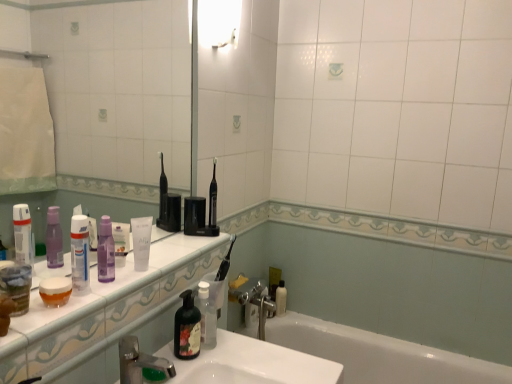
Question: Does silver metallic faucet at lower center have a lesser width compared to white matte tube at center, placed as the 2th toiletry when sorted from left to right?

Choices:
 (A) yes
 (B) no

Answer: (B)

Question: Is silver metallic faucet at lower center taller than white matte tube at center, positioned as the 4th toiletry in right-to-left order?

Choices:
 (A) yes
 (B) no

Answer: (B)

Question: Does silver metallic faucet at lower center have a larger size compared to white matte tube at center, which appears as the 4th toiletry when viewed from the back?

Choices:
 (A) yes
 (B) no

Answer: (B)

Question: Can you confirm if silver metallic faucet at lower center is positioned to the left of white matte tube at center, positioned as the 4th toiletry in right-to-left order?

Choices:
 (A) no
 (B) yes

Answer: (A)

Question: From the image's perspective, would you say silver metallic faucet at lower center is shown under white matte tube at center, placed as the second toiletry when sorted from front to back?

Choices:
 (A) no
 (B) yes

Answer: (B)

Question: Considering the positions of white glossy bathtub at lower center and black plastic toothbrush at center in the image, is white glossy bathtub at lower center taller or shorter than black plastic toothbrush at center?

Choices:
 (A) tall
 (B) short

Answer: (A)

Question: From the image's perspective, relative to black plastic toothbrush at center, is white glossy bathtub at lower center above or below?

Choices:
 (A) above
 (B) below

Answer: (B)

Question: Considering the positions of point (279, 342) and point (214, 225), is point (279, 342) closer or farther from the camera than point (214, 225)?

Choices:
 (A) closer
 (B) farther

Answer: (B)

Question: Is white glossy bathtub at lower center spatially inside black plastic toothbrush at center, or outside of it?

Choices:
 (A) outside
 (B) inside

Answer: (A)

Question: From the image's perspective, is white glossy sink at lower center above or below white matte tube at center, which appears as the 4th toiletry when viewed from the back?

Choices:
 (A) below
 (B) above

Answer: (A)

Question: Is white glossy sink at lower center to the left or to the right of white matte tube at center, placed as the 2th toiletry when sorted from left to right, in the image?

Choices:
 (A) right
 (B) left

Answer: (A)

Question: From a real-world perspective, is white glossy sink at lower center positioned above or below white matte tube at center, placed as the 2th toiletry when sorted from left to right?

Choices:
 (A) below
 (B) above

Answer: (A)

Question: Is white glossy sink at lower center wider or thinner than white matte tube at center, placed as the second toiletry when sorted from front to back?

Choices:
 (A) thin
 (B) wide

Answer: (B)

Question: Based on their sizes in the image, would you say white matte tube at center, placed as the 2th toiletry when sorted from left to right, is bigger or smaller than white glossy bathtub at lower center?

Choices:
 (A) big
 (B) small

Answer: (B)

Question: Is white matte tube at center, which appears as the 4th toiletry when viewed from the back, in front of or behind white glossy bathtub at lower center in the image?

Choices:
 (A) behind
 (B) front

Answer: (B)